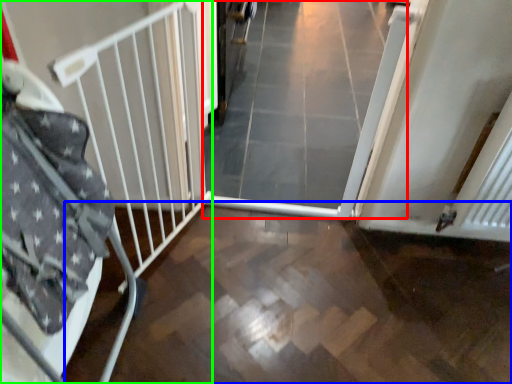
Question: Estimate the real-world distances between objects in this image. Which object is farther from plain (highlighted by a red box), path (highlighted by a blue box) or bed frame (highlighted by a green box)?

Choices:
 (A) path
 (B) bed frame

Answer: (B)